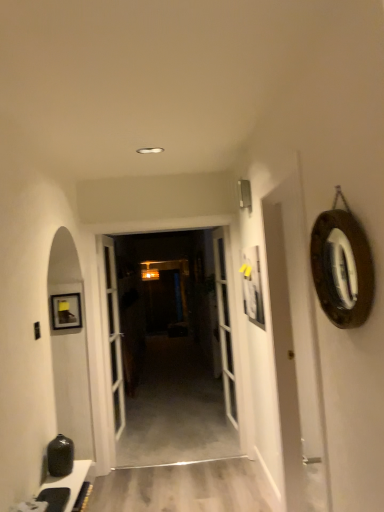
You are a GUI agent. You are given a task and a screenshot of the screen. Output one action in this format:
    pyautogui.click(x=<x>, y=<y>)
    Task: Click on the empty space that is ontop of matte black cabinet at lower left (from a real-world perspective)
    Image resolution: width=384 pixels, height=512 pixels.
    Given the screenshot: What is the action you would take?
    pyautogui.click(x=67, y=476)